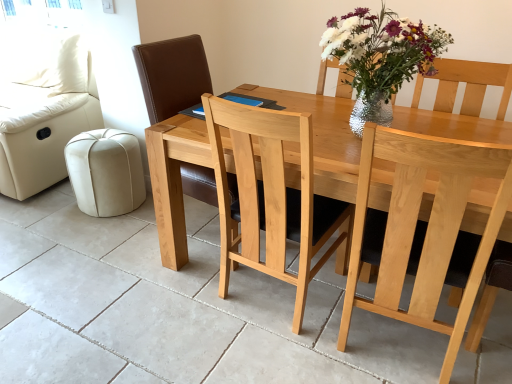
Locate an element on the screen. free location to the left of natural wood table at center is located at coordinates (142, 309).